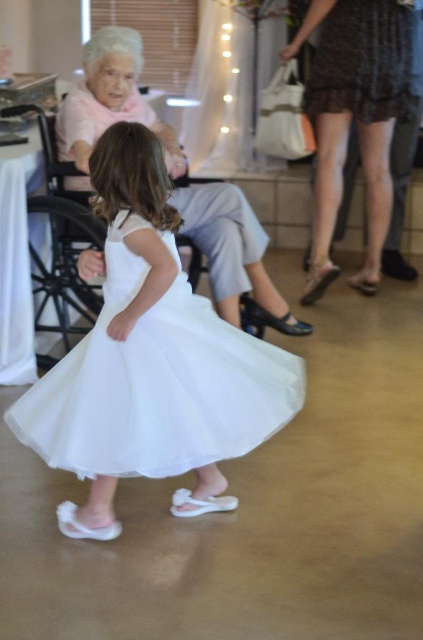
You are at a party and see two dresses. The white tulle dress at center and the matte pink dress at upper left. Which dress is positioned lower in the image?

The white tulle dress at center is located below the matte pink dress at upper left, so the white tulle dress at center is positioned lower in the image.

You are at a party and want to take a photo of the white tulle dress at center and the matte pink dress at upper left. Which dress should you focus on first to ensure both are in the frame?

You should focus on the white tulle dress at center first because it is in front of the matte pink dress at upper left, so positioning the camera to include the foreground dress will naturally include the background one as well.